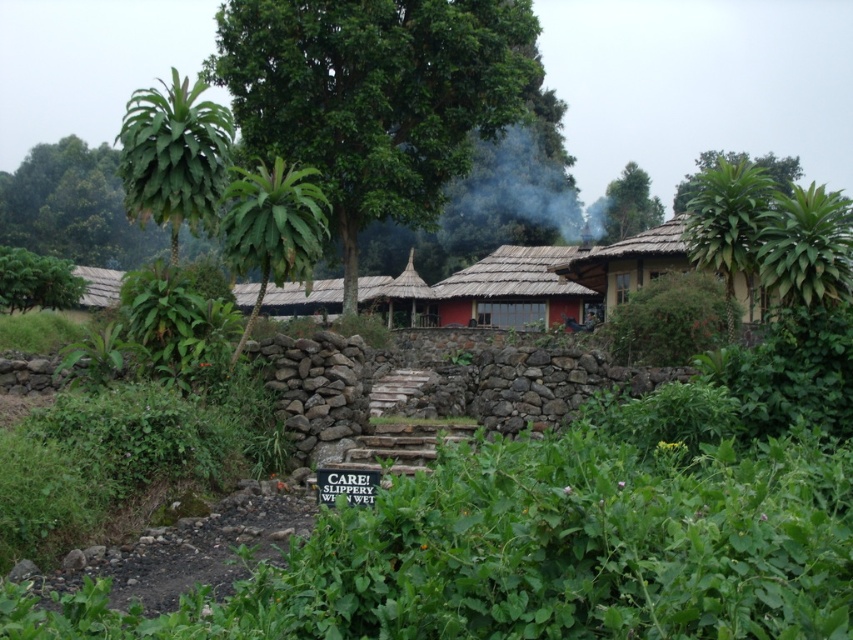
Does point (506, 195) lie behind point (94, 289)?

Yes, it is behind point (94, 289).

Who is shorter, gray smoke at upper center or thatched roof hut at left?

thatched roof hut at left

This screenshot has height=640, width=853. Describe the element at coordinates (514, 189) in the screenshot. I see `gray smoke at upper center` at that location.

The width and height of the screenshot is (853, 640). In order to click on gray smoke at upper center in this screenshot , I will do `click(514, 189)`.

Between point (654, 225) and point (798, 157), which one is positioned behind?

Positioned behind is point (798, 157).

The width and height of the screenshot is (853, 640). What are the coordinates of `green leafy tree at upper center` in the screenshot? It's located at (x=628, y=205).

Is point (589, 268) positioned after point (84, 268)?

That is False.

Between point (583, 284) and point (103, 285), which one is positioned in front?

Positioned in front is point (583, 284).

The height and width of the screenshot is (640, 853). Identify the location of brown thatched hut at right. (630, 260).